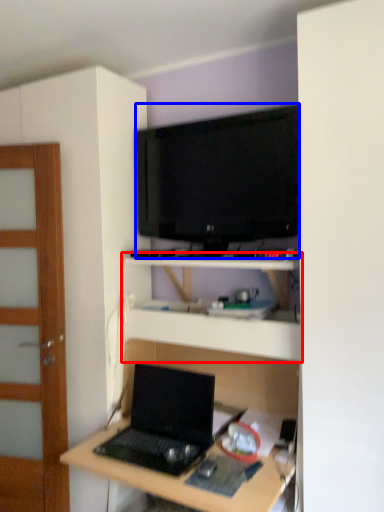
Question: Which object appears farthest to the camera in this image, shelf (highlighted by a red box) or television (highlighted by a blue box)?

Choices:
 (A) shelf
 (B) television

Answer: (B)